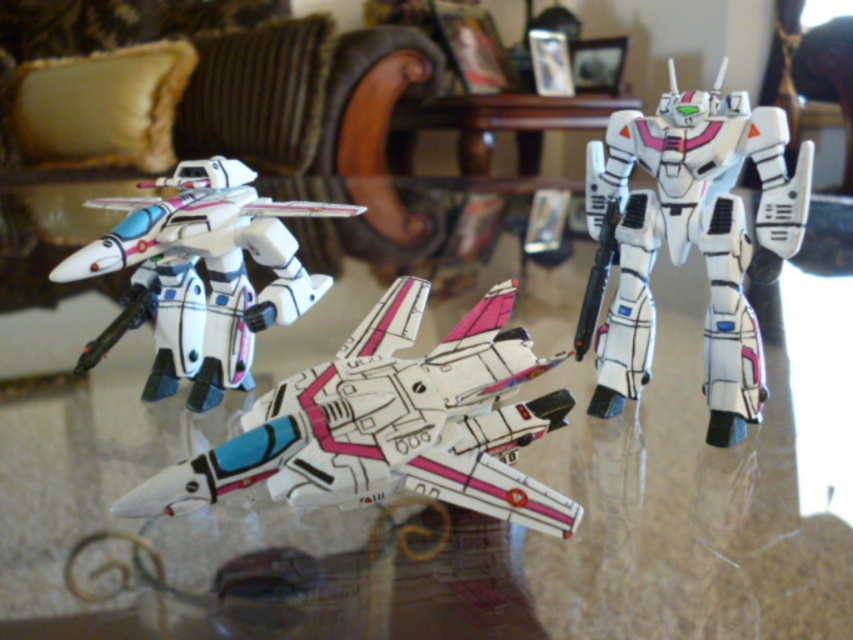
You are a small toy car that is 5 cm tall. You are on the transparent glass table at center and want to drive off the edge to the floor. Can you do so without hitting the white glossy plane at center?

The transparent glass table at center is much taller than the white glossy plane at center, so the car can drive off the edge without hitting the plane.